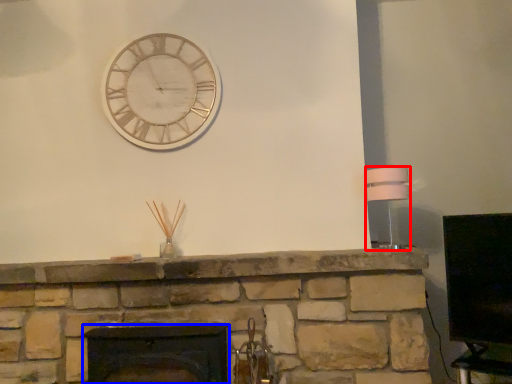
Question: Among these objects, which one is nearest to the camera, lamp (highlighted by a red box) or fireplace (highlighted by a blue box)?

Choices:
 (A) lamp
 (B) fireplace

Answer: (B)